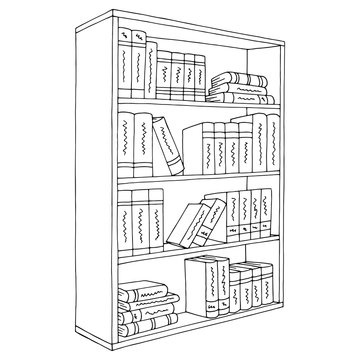
Where is `shelf under books`? shelf under books is located at coordinates (180, 103), (177, 178), (173, 251), (194, 325).